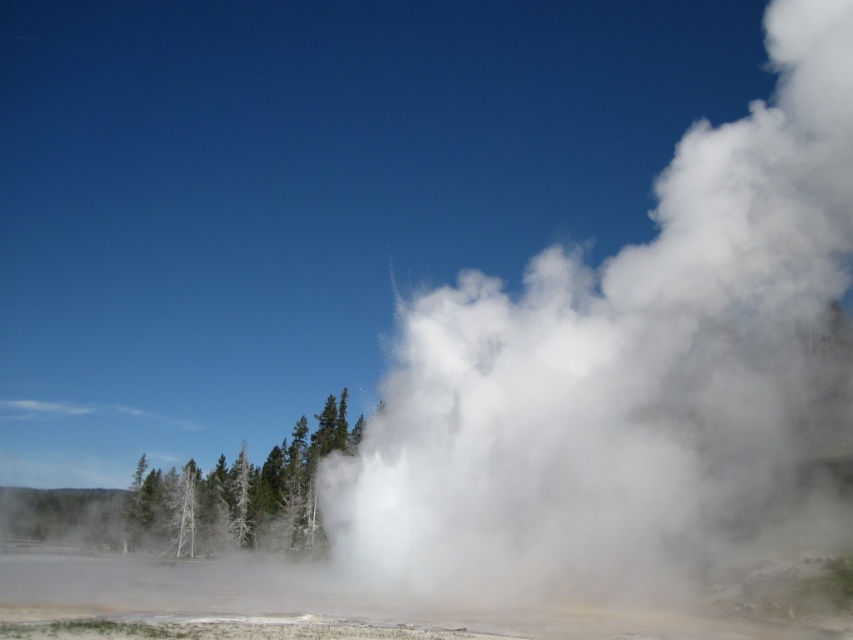
Question: Which point is farther to the camera?

Choices:
 (A) green matte tree at center
 (B) white vapor at center

Answer: (A)

Question: Can you confirm if white vapor at center is positioned to the left of green matte tree at center?

Choices:
 (A) no
 (B) yes

Answer: (A)

Question: Can you confirm if white vapor at center is bigger than green matte tree at center?

Choices:
 (A) yes
 (B) no

Answer: (A)

Question: Which point is farther to the camera?

Choices:
 (A) pos(254,504)
 (B) pos(733,170)

Answer: (A)

Question: Is white vapor at center to the right of green matte tree at center from the viewer's perspective?

Choices:
 (A) no
 (B) yes

Answer: (B)